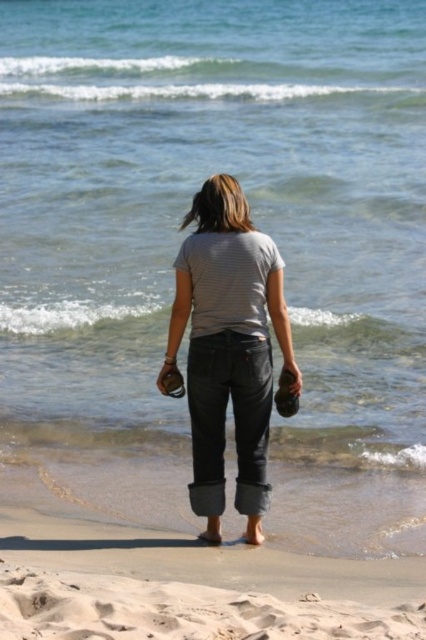
You are a photographer trying to capture the woman in the gray cotton shirt at center and the sandy beach at lower center in a single shot. Which object should you focus on first to ensure both are in frame?

The gray cotton shirt at center is much taller than the sandy beach at lower center, so you should focus on the gray cotton shirt at center first to ensure both are in frame.

You are a photographer positioned behind the woman in the image. You want to capture a photo that includes both the gray cotton shirt at center and the sandy beach at lower center. Which object should you adjust your camera focus to first to ensure both are in the frame?

You should focus on the gray cotton shirt at center first because it is closer to you than the sandy beach at lower center, so adjusting focus starting from the closer object ensures both will be in the frame.

You are a photographer trying to capture the scene of the woman on the beach. To ensure the gray cotton shirt at center and the sandy beach at lower center are both clearly visible in the shot, where should you position the camera relative to the woman?

The gray cotton shirt at center is located above the sandy beach at lower center, so positioning the camera at a lower angle would ensure both the shirt and the beach are clearly visible in the frame.